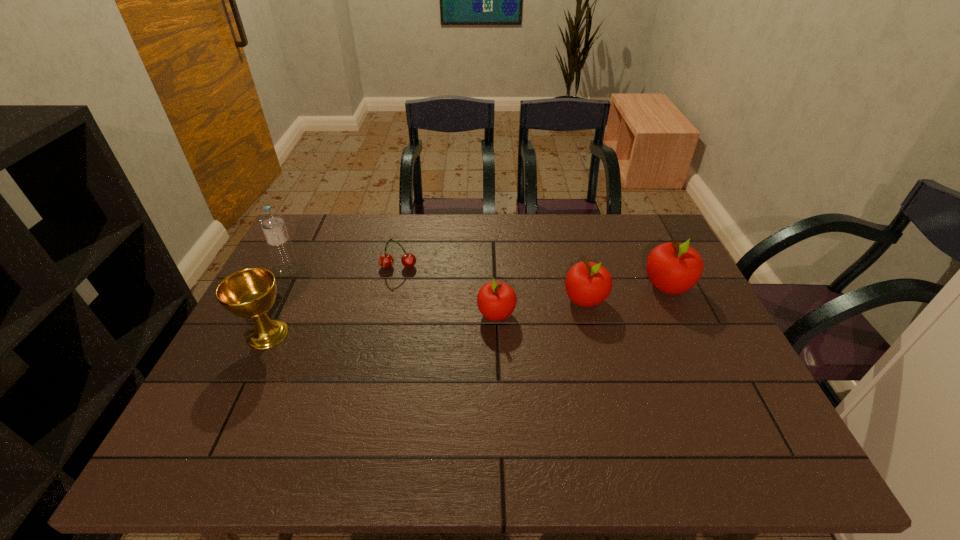
Locate an element on the screen. This screenshot has width=960, height=540. vacant space located on the front of the rightmost apple is located at coordinates tap(711, 378).

Find the location of a particular element. vacant space positioned on the right of the tallest object is located at coordinates (336, 272).

The image size is (960, 540). What are the coordinates of `free spot located with stems pointing upwards on the third object from left to right` in the screenshot? It's located at (392, 297).

I want to click on vacant area situated on the right of the chalice, so click(x=431, y=334).

Locate an element on the screen. This screenshot has width=960, height=540. water bottle located in the left edge section of the desktop is located at coordinates (272, 223).

Locate an element on the screen. This screenshot has width=960, height=540. chalice at the left edge is located at coordinates (249, 293).

You are a GUI agent. You are given a task and a screenshot of the screen. Output one action in this format:
    pyautogui.click(x=<x>, y=<y>)
    Task: Click on the object situated at the right edge
    Image resolution: width=960 pixels, height=540 pixels.
    Given the screenshot: What is the action you would take?
    pyautogui.click(x=673, y=268)

This screenshot has height=540, width=960. Find the location of `vacant space at the far edge of the desktop`. vacant space at the far edge of the desktop is located at coordinates (603, 248).

This screenshot has height=540, width=960. In the image, there is a desktop. Identify the location of vacant space at the near edge. (473, 397).

In the image, there is a desktop. Where is `vacant space at the left edge`? The image size is (960, 540). vacant space at the left edge is located at coordinates [303, 319].